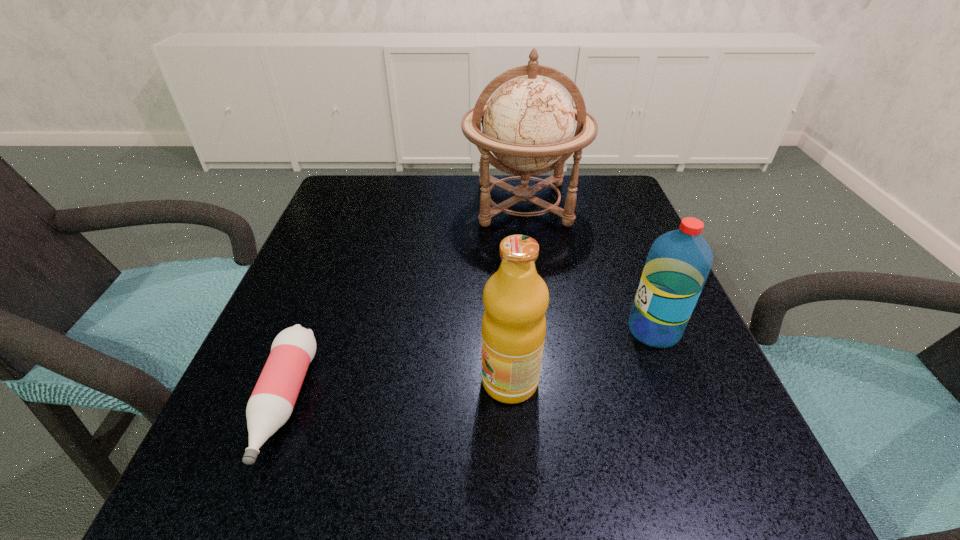
What are the coordinates of `object situated at the far right corner` in the screenshot? It's located at (528, 124).

In the image, there is a desktop. Where is `vacant space at the far edge`? vacant space at the far edge is located at coordinates (468, 182).

This screenshot has height=540, width=960. Identify the location of free space at the near edge of the desktop. pos(402,503).

Where is `vacant area at the left edge`? The height and width of the screenshot is (540, 960). vacant area at the left edge is located at coordinates (334, 408).

The height and width of the screenshot is (540, 960). In the image, there is a desktop. What are the coordinates of `vacant space at the right edge` in the screenshot? It's located at (620, 267).

Identify the location of free region at the far left corner of the desktop. pos(345,176).

Identify the location of free space at the far right corner. (633, 214).

Image resolution: width=960 pixels, height=540 pixels. I want to click on free space at the near right corner of the desktop, so click(x=762, y=510).

Identify the location of free point between the rightmost object and the third shortest object. (582, 355).

Identify the location of free area in between the tallest object and the bottle. (404, 303).